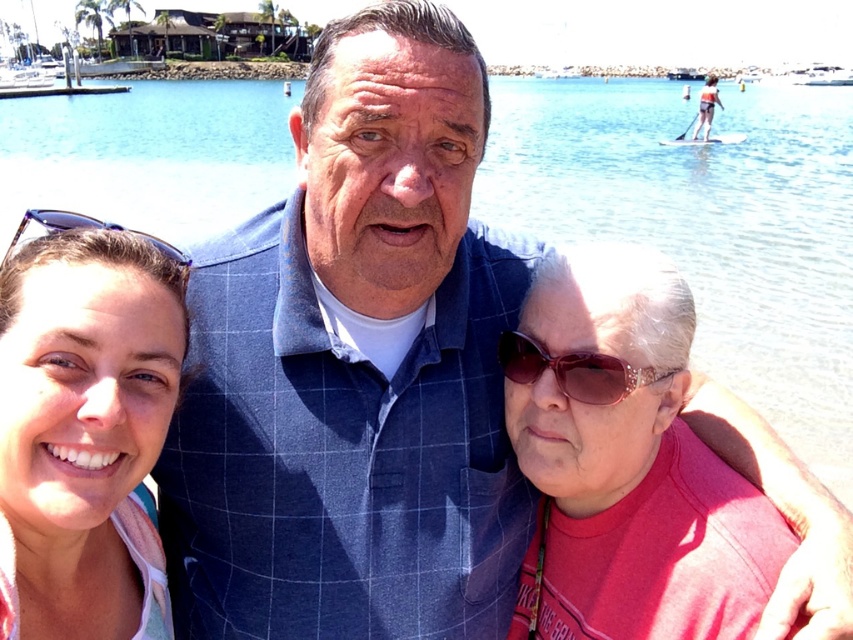
You are standing at point (x=108, y=618) and want to walk to point (x=672, y=627). Which direction should you move in relation to the central figure in the image?

You should move behind the central figure to reach point (x=672, y=627) from point (x=108, y=618) since point (x=672, y=627) is behind point (x=108, y=618).

You are taking a photo of the group and need to ensure the matte pink shirt at center is in focus. Based on their positions, which person should you adjust the camera to focus on?

The matte pink shirt at center is located at point (630, 460), so you should focus on the central figure wearing the blue checkered shirt over a white undershirt as the matte pink shirt at center belongs to them.

In the scene shown: You are a photographer trying to focus on the matte pink shirt at center and the pink fabric at upper right. Which object should you adjust your camera focus on first to ensure it appears clearer in the photo?

You should focus on the matte pink shirt at center first because it is closer to the viewer than the pink fabric at upper right, so adjusting focus starting from the closer object ensures clarity.